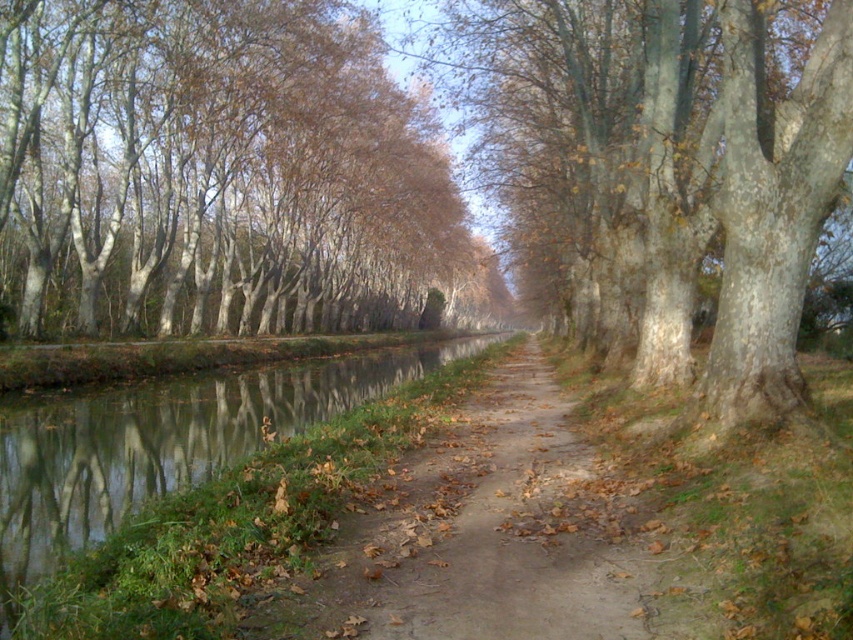
Does brown dirt path at center have a greater width compared to smooth gray bark tree at center?

In fact, brown dirt path at center might be narrower than smooth gray bark tree at center.

Does brown dirt path at center appear on the right side of smooth gray bark tree at center?

In fact, brown dirt path at center is to the left of smooth gray bark tree at center.

The image size is (853, 640). Find the location of `brown dirt path at center`. brown dirt path at center is located at coordinates (485, 536).

Does smooth bark trees at left have a greater width compared to brown dirt path at center?

Yes.

Is smooth bark trees at left above brown dirt path at center?

Indeed, smooth bark trees at left is positioned over brown dirt path at center.

Is point (289, 28) farther from camera compared to point (579, 536)?

Yes, point (289, 28) is behind point (579, 536).

Find the location of a particular element. smooth bark trees at left is located at coordinates (222, 173).

Is smooth bark trees at left wider than smooth gray bark tree at center?

Yes, smooth bark trees at left is wider than smooth gray bark tree at center.

In order to click on smooth bark trees at left in this screenshot , I will do pyautogui.click(x=222, y=173).

Between point (225, 161) and point (811, 221), which one is positioned behind?

The point (225, 161) is more distant.

Where is `smooth bark trees at left`? This screenshot has height=640, width=853. smooth bark trees at left is located at coordinates (222, 173).